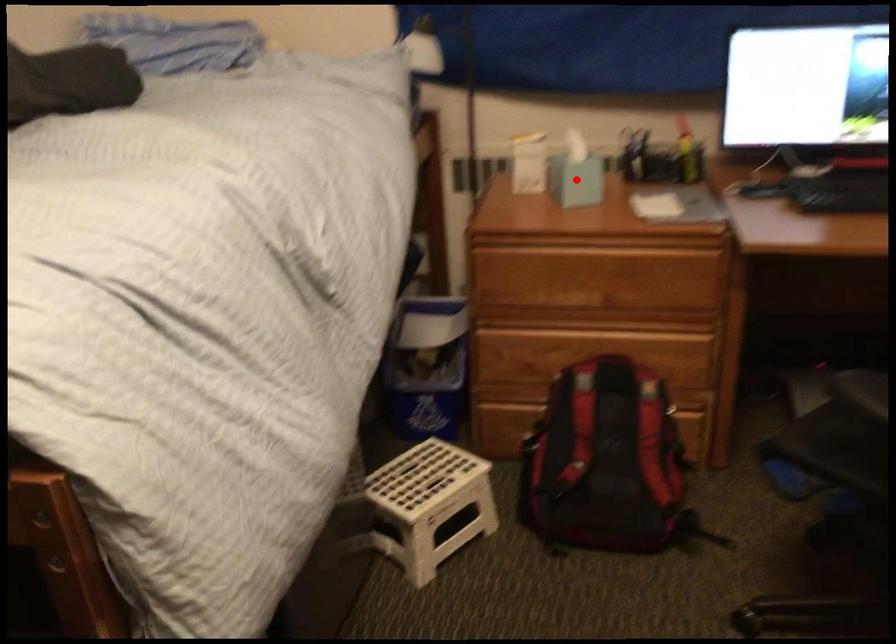
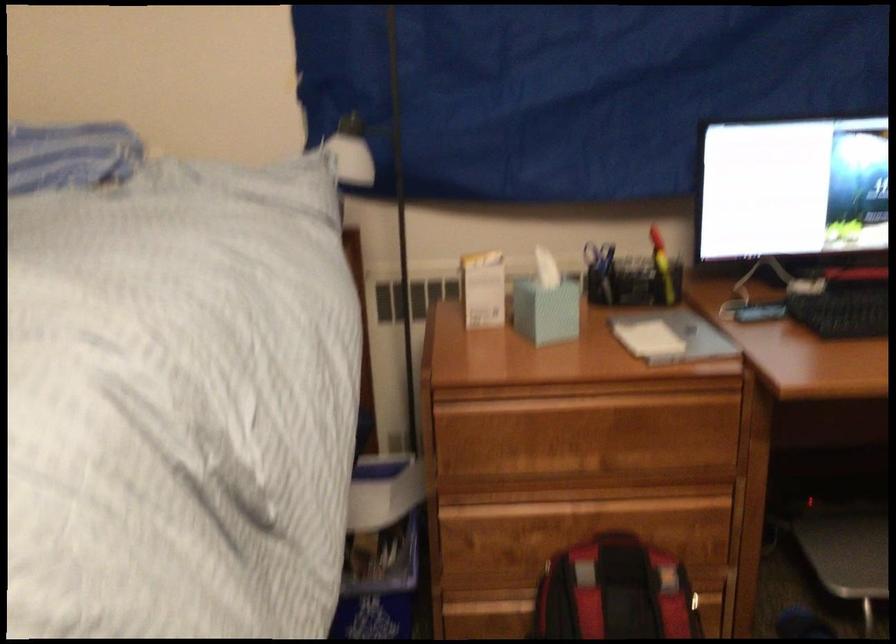
Question: I am providing you with two images of the same scene from different viewpoints. In image1, a red point is highlighted. Considering the same 3D point in image2, which of the following is correct?

Choices:
 (A) It is closer
 (B) It is farther

Answer: (A)